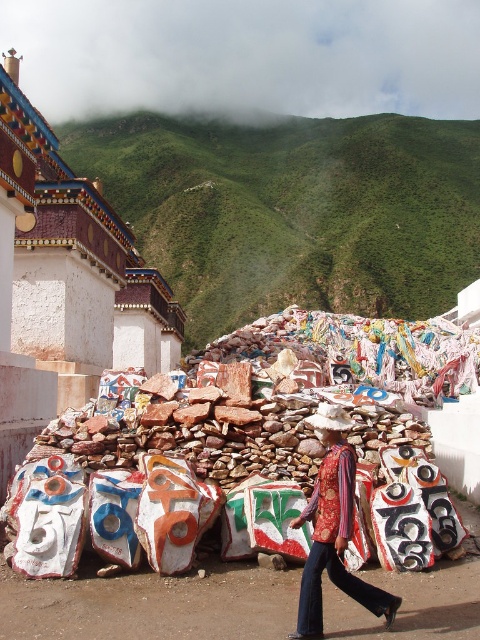
Can you confirm if green grassy hillside at upper center is positioned above patterned fabric shirt at center?

Correct, green grassy hillside at upper center is located above patterned fabric shirt at center.

Who is positioned more to the right, green grassy hillside at upper center or patterned fabric shirt at center?

green grassy hillside at upper center

What do you see at coordinates (292, 211) in the screenshot? The image size is (480, 640). I see `green grassy hillside at upper center` at bounding box center [292, 211].

Where is `green grassy hillside at upper center`? The height and width of the screenshot is (640, 480). green grassy hillside at upper center is located at coordinates [292, 211].

Who is positioned more to the left, white painted stone at upper left or patterned fabric shirt at center?

white painted stone at upper left

Does point (47, 129) come closer to viewer compared to point (348, 589)?

No, it is not.

The height and width of the screenshot is (640, 480). I want to click on white painted stone at upper left, so click(79, 273).

How much distance is there between green grassy hillside at upper center and white painted stone at upper left?

The distance of green grassy hillside at upper center from white painted stone at upper left is 155.08 meters.

Can you confirm if green grassy hillside at upper center is taller than white painted stone at upper left?

Yes, green grassy hillside at upper center is taller than white painted stone at upper left.

Image resolution: width=480 pixels, height=640 pixels. In order to click on green grassy hillside at upper center in this screenshot , I will do `click(292, 211)`.